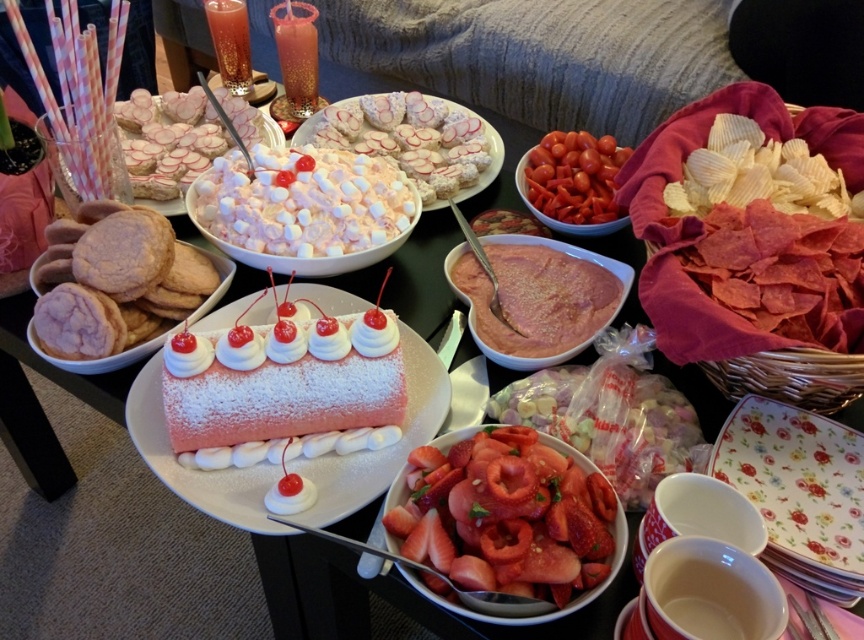
Question: Does pink frosted glass at center lie in front of translucent glass beverage at upper left?

Choices:
 (A) no
 (B) yes

Answer: (B)

Question: Among these points, which one is nearest to the camera?

Choices:
 (A) [x=826, y=541]
 (B) [x=236, y=193]
 (C) [x=529, y=339]

Answer: (A)

Question: Among these objects, which one is farthest from the camera?

Choices:
 (A) pink frosted glass at center
 (B) white fluffy dessert at center
 (C) red glossy cherry tomatoes at center

Answer: (A)

Question: Among these points, which one is farthest from the camera?

Choices:
 (A) (567, 266)
 (B) (255, 337)
 (C) (274, 170)
 (D) (288, 83)

Answer: (D)

Question: Is sliced pink strawberry at center further to camera compared to pink frosted glass at center?

Choices:
 (A) yes
 (B) no

Answer: (B)

Question: Can you confirm if red glossy cherry tomatoes at center is smaller than pink frosted glass at center?

Choices:
 (A) yes
 (B) no

Answer: (A)